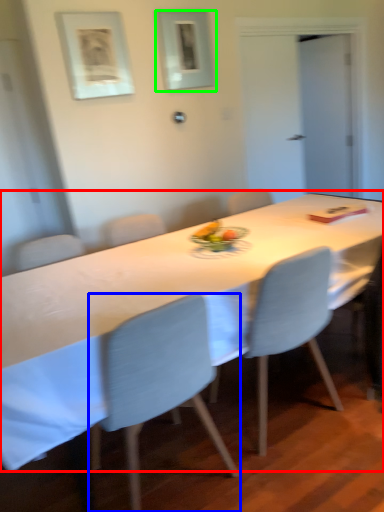
Question: Based on their relative distances, which object is nearer to table (highlighted by a red box)? Choose from chair (highlighted by a blue box) and picture frame (highlighted by a green box).

Choices:
 (A) chair
 (B) picture frame

Answer: (A)